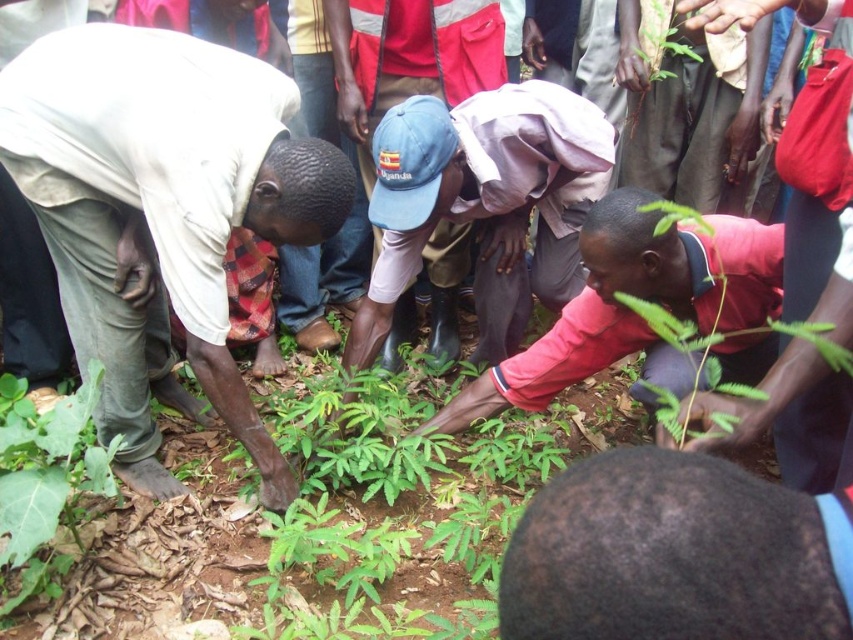
Question: Which point is closer to the camera?

Choices:
 (A) (3, 612)
 (B) (757, 552)
 (C) (433, 157)
 (D) (318, 141)

Answer: (B)

Question: In this image, where is light beige fabric at lower left located relative to dark brown hair at lower center?

Choices:
 (A) right
 (B) left

Answer: (B)

Question: Is blue rubber boots at center smaller than green leafy plant at upper right?

Choices:
 (A) yes
 (B) no

Answer: (B)

Question: Which object is farther from the camera taking this photo?

Choices:
 (A) dark brown hair at lower center
 (B) light beige fabric at lower left
 (C) blue rubber boots at center
 (D) green leafy plant at upper right

Answer: (D)

Question: Which point appears closest to the camera in this image?

Choices:
 (A) (693, 70)
 (B) (578, 134)

Answer: (B)

Question: From the image, what is the correct spatial relationship of blue rubber boots at center in relation to green leafy plant at upper right?

Choices:
 (A) above
 (B) below

Answer: (B)